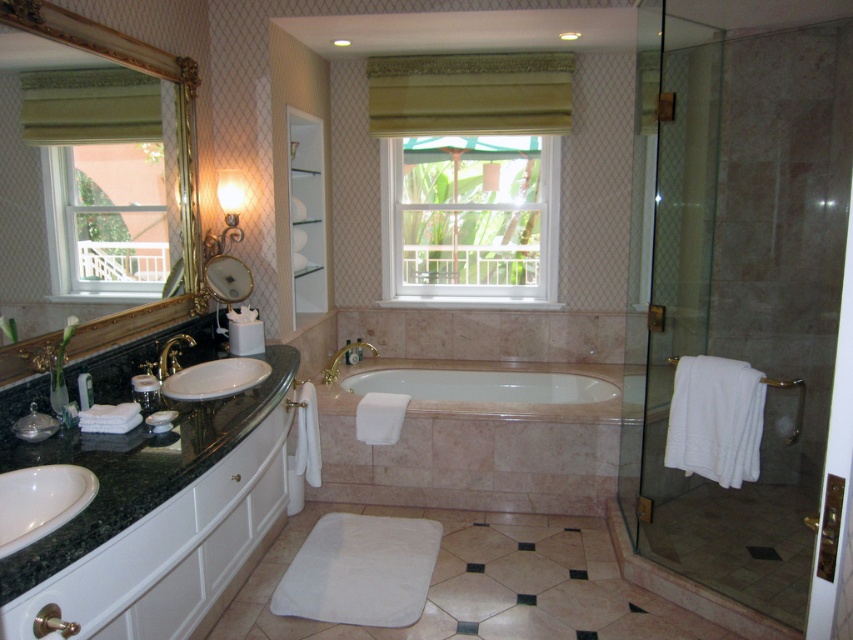
You are a contractor measuring the bathroom for new fixtures. You need to install a new shower enclosure and a larger bathtub. Based on the current layout, which object should you consider replacing first, the transparent glass shower door at right or the white marble bathtub at center, to accommodate the new fixtures?

The transparent glass shower door at right is larger in size than the white marble bathtub at center, so you should consider replacing the transparent glass shower door at right first to accommodate the new fixtures.